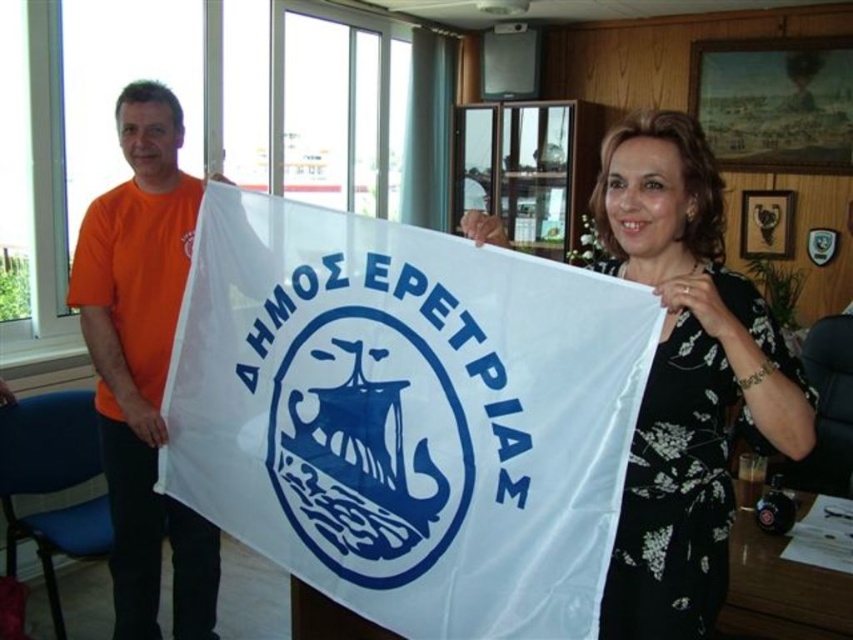
You are standing in the room where the two people are holding the flag. You want to place a small sticker on the flag. If you choose to place it closer to the person on the right, which point should you choose between point [540,321] and point [679,284]?

Point [679,284] is closer to the person on the right, so you should place the sticker there.